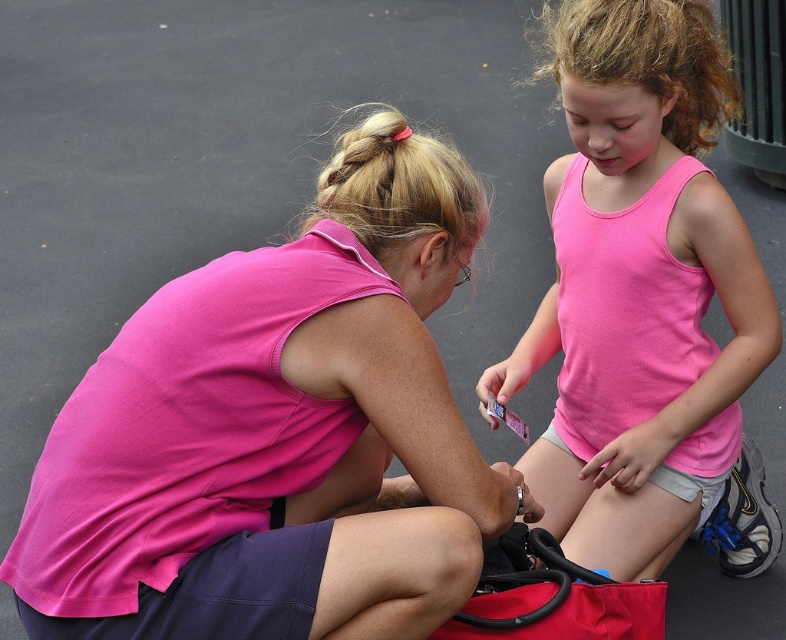
What are the coordinates of the pink fabric shirt at center?

The pink fabric shirt at center is located at coordinates point (x=278, y=433).

Looking at this image, you are a photographer trying to capture a candid shot of the two people in the scene. You want to ensure both the pink fabric shirt at center and the pink matte tank top at center are clearly visible in your photo. Based on their positions, which one should you focus on first to ensure proper framing?

The pink fabric shirt at center is to the left of the pink matte tank top at center, so focusing on the pink matte tank top at center first would allow you to frame both subjects effectively as they are positioned side by side.

You are a photographer trying to capture a clear photo of both the pink fabric shirt at center and the pink matte tank top at center. Since they are both at center, which one will appear larger in the photo?

The pink fabric shirt at center will appear larger in the photo because it is closer to the viewer than the pink matte tank top at center.